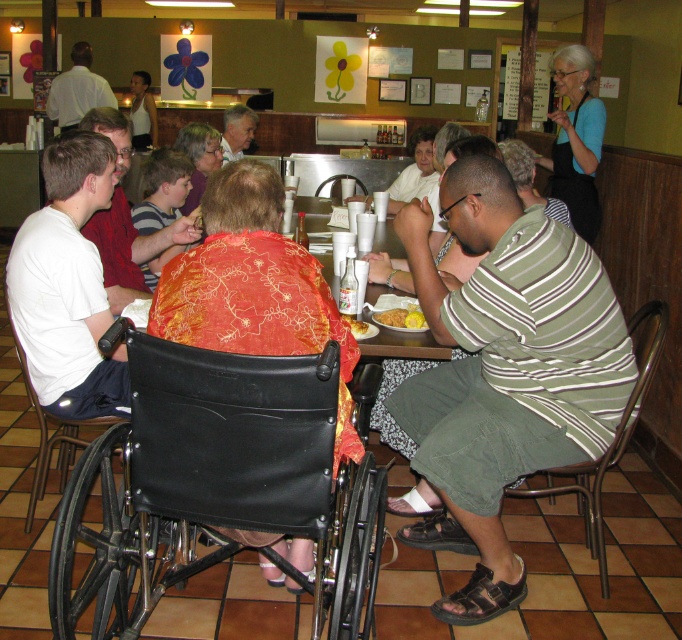
Question: Among these points, which one is nearest to the camera?

Choices:
 (A) (546, 291)
 (B) (72, 300)

Answer: (A)

Question: Where is black leather wheelchair at center located in relation to matte red shirt at center in the image?

Choices:
 (A) right
 (B) left

Answer: (A)

Question: Can you confirm if matte red shirt at center is positioned to the left of matte gray shirt at center?

Choices:
 (A) yes
 (B) no

Answer: (A)

Question: Which is nearer to the white shirt at upper left?

Choices:
 (A) wooden table at center
 (B) black leather wheelchair at center
 (C) striped cotton shirt at center
 (D) matte gray shirt at center

Answer: (D)

Question: Can you confirm if matte red shirt at center is positioned below white shirt at upper left?

Choices:
 (A) yes
 (B) no

Answer: (A)

Question: Which object is closer to the camera taking this photo?

Choices:
 (A) black leather wheelchair at center
 (B) wooden table at center
 (C) yellow matte cornbread at center

Answer: (A)